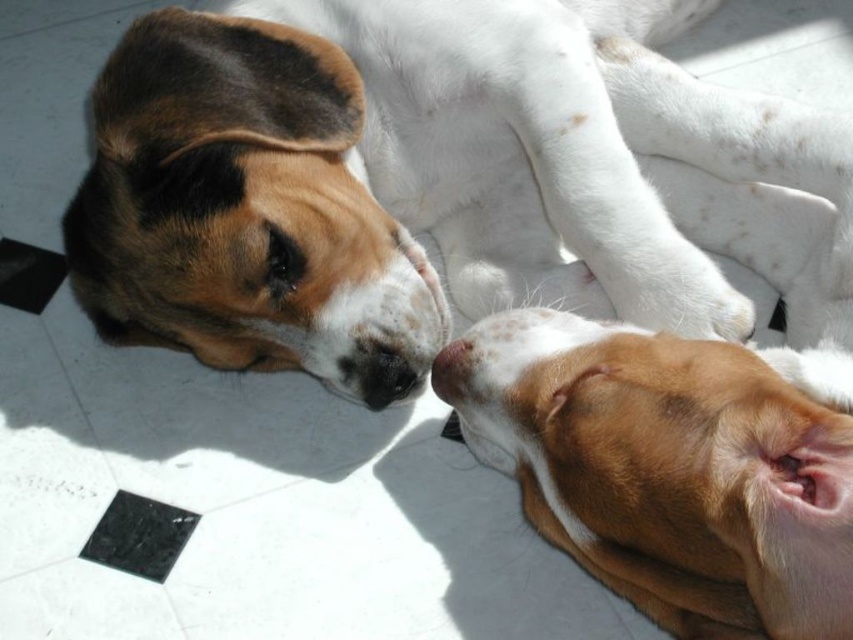
Is brown soft fur at lower right to the right of brown matte nose at lower center from the viewer's perspective?

Correct, you'll find brown soft fur at lower right to the right of brown matte nose at lower center.

Can you confirm if brown soft fur at lower right is bigger than brown matte nose at lower center?

Yes, brown soft fur at lower right is bigger than brown matte nose at lower center.

Does point (831, 582) lie behind point (440, 353)?

That is False.

This screenshot has width=853, height=640. I want to click on brown soft fur at lower right, so click(x=671, y=472).

Is brown and white fur at upper left closer to the viewer compared to brown soft fur at lower right?

No, brown and white fur at upper left is behind brown soft fur at lower right.

From the picture: Is brown and white fur at upper left taller than brown soft fur at lower right?

Yes, brown and white fur at upper left is taller than brown soft fur at lower right.

Does point (813, 205) come behind point (828, 522)?

Yes, it is behind point (828, 522).

The height and width of the screenshot is (640, 853). I want to click on brown and white fur at upper left, so click(450, 188).

Does brown and white fur at upper left have a greater width compared to brown matte nose at lower center?

Correct, the width of brown and white fur at upper left exceeds that of brown matte nose at lower center.

From the picture: Who is higher up, brown and white fur at upper left or brown matte nose at lower center?

brown and white fur at upper left is above.

What are the coordinates of `brown and white fur at upper left` in the screenshot? It's located at (450, 188).